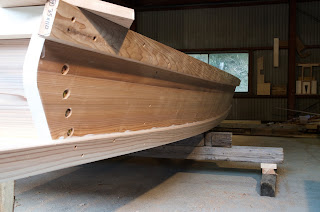
Where is `windows`? This screenshot has width=320, height=212. windows is located at coordinates (200, 54), (226, 58).